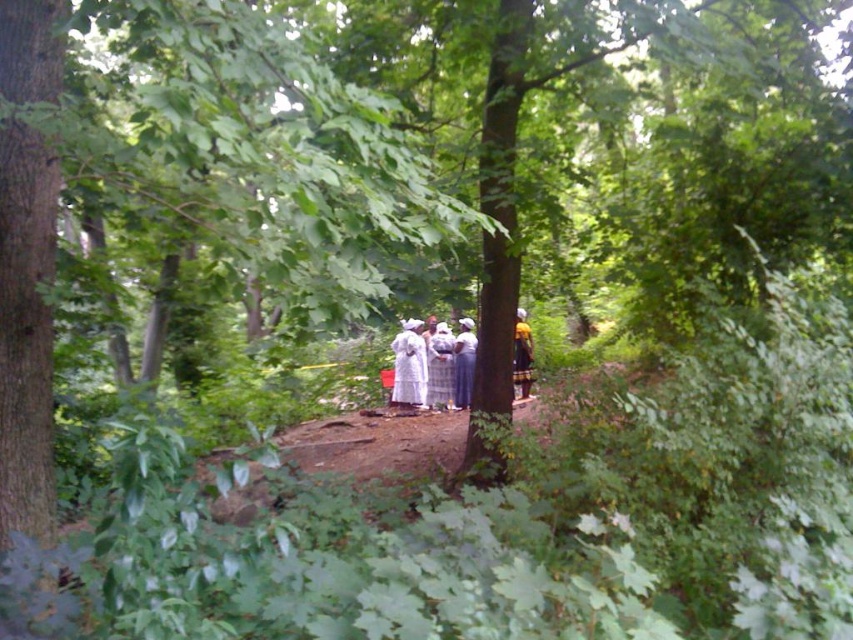
Question: Which point is farther to the camera?

Choices:
 (A) white fabric at center
 (B) yellow fabric dress at center

Answer: (A)

Question: Is white fabric at center to the left of yellow fabric dress at center from the viewer's perspective?

Choices:
 (A) yes
 (B) no

Answer: (A)

Question: Does white fabric at center appear under yellow fabric dress at center?

Choices:
 (A) no
 (B) yes

Answer: (B)

Question: Does white fabric at center appear over yellow fabric dress at center?

Choices:
 (A) no
 (B) yes

Answer: (A)

Question: Among these objects, which one is nearest to the camera?

Choices:
 (A) white fabric at center
 (B) yellow fabric dress at center

Answer: (B)